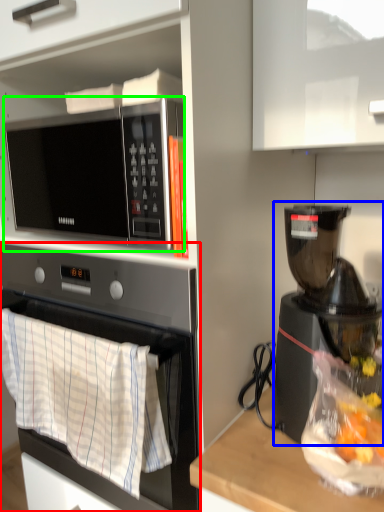
Question: Which object is the closest to the oven (highlighted by a red box)? Choose among these: coffee maker (highlighted by a blue box) or microwave oven (highlighted by a green box).

Choices:
 (A) coffee maker
 (B) microwave oven

Answer: (B)